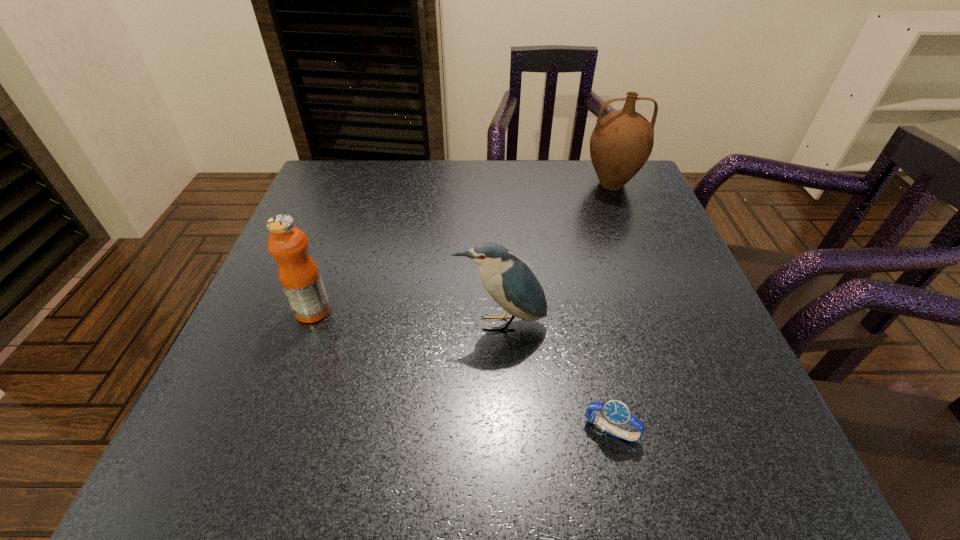
Locate an element on the screen. This screenshot has height=540, width=960. object that is at the far edge is located at coordinates (622, 141).

Where is `object at the near edge`? The height and width of the screenshot is (540, 960). object at the near edge is located at coordinates point(616,413).

Locate an element on the screen. object located in the left edge section of the desktop is located at coordinates (298, 273).

You are a GUI agent. You are given a task and a screenshot of the screen. Output one action in this format:
    pyautogui.click(x=<x>, y=<y>)
    Task: Click on the object positioned at the right edge
    
    Given the screenshot: What is the action you would take?
    pyautogui.click(x=622, y=141)

The width and height of the screenshot is (960, 540). Identify the location of object located at the far right corner. (622, 141).

You are a GUI agent. You are given a task and a screenshot of the screen. Output one action in this format:
    pyautogui.click(x=<x>, y=<y>)
    Task: Click on the vacant space at the far edge
    This screenshot has width=960, height=540.
    Given the screenshot: What is the action you would take?
    pyautogui.click(x=542, y=201)

Where is `vacant region at the left edge of the desktop`? vacant region at the left edge of the desktop is located at coordinates (259, 334).

At what (x,y) coordinates should I click in order to perform the action: click on blank space at the right edge. Please return your answer as a coordinate pair (x, y). The width and height of the screenshot is (960, 540). Looking at the image, I should click on (685, 338).

Where is `free space at the far left corner of the desktop`? free space at the far left corner of the desktop is located at coordinates (366, 185).

I want to click on free spot at the near left corner of the desktop, so click(207, 463).